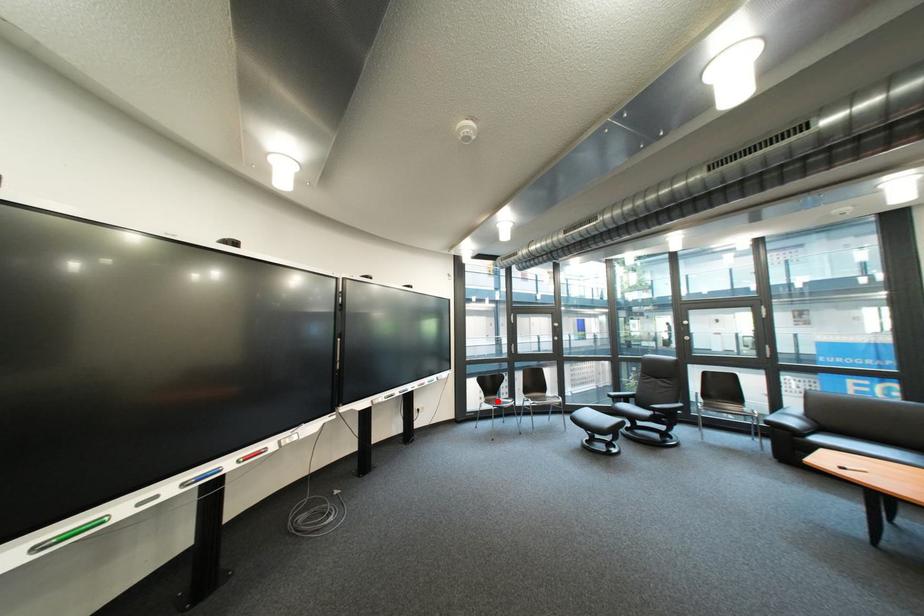
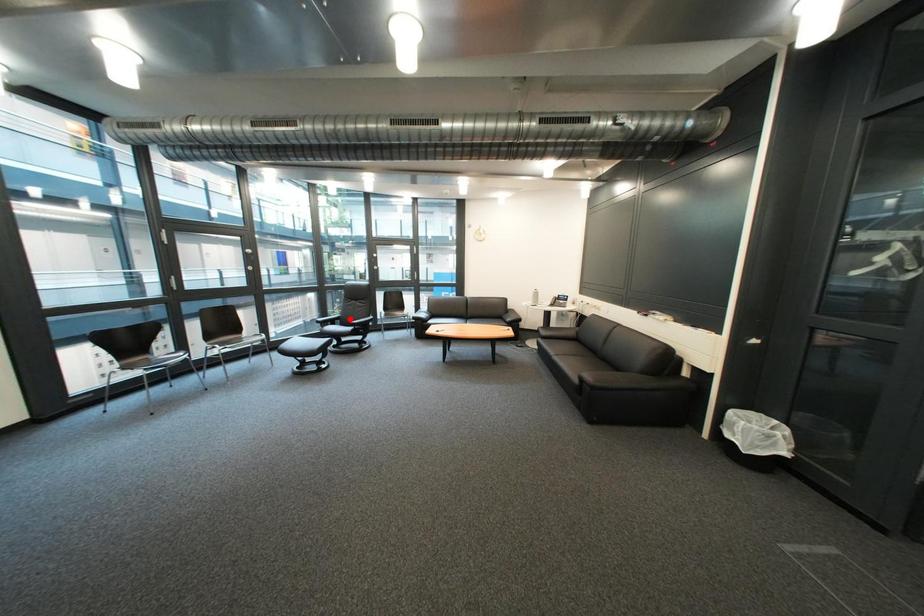
I am providing you with two images of the same scene from different viewpoints. A red point is marked on the first image and another point is marked on the second image. Are the points marked in image1 and image2 representing the same 3D position?

No